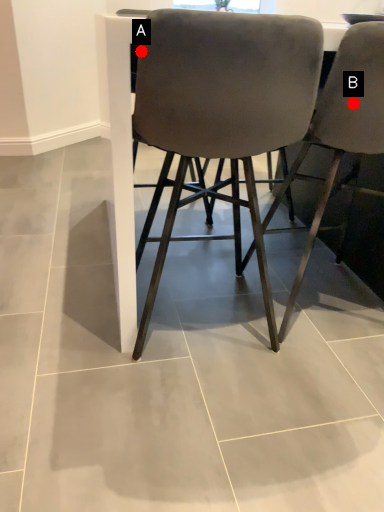
Question: Two points are circled on the image, labeled by A and B beside each circle. Which point is closer to the camera taking this photo?

Choices:
 (A) A is closer
 (B) B is closer

Answer: (A)